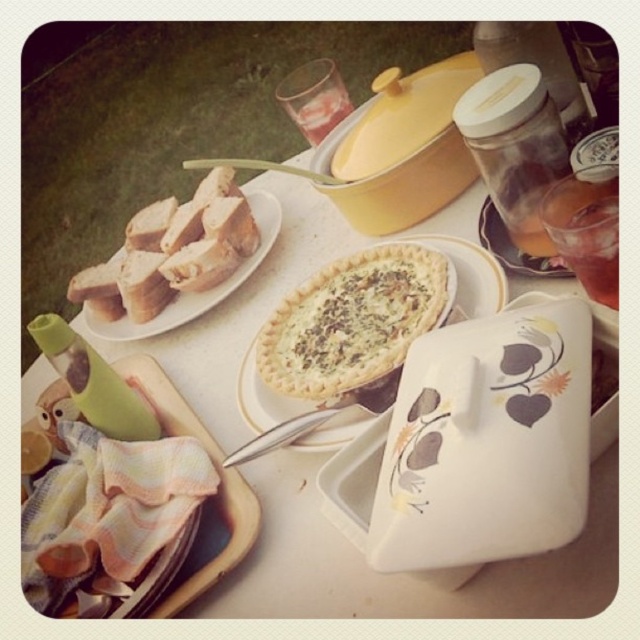
Question: Can you confirm if golden flaky pie at center is wider than white ceramic plate at upper left?

Choices:
 (A) no
 (B) yes

Answer: (A)

Question: Which object appears farthest from the camera in this image?

Choices:
 (A) white ceramic plate at upper left
 (B) golden flaky pie at center
 (C) translucent glass at upper right
 (D) white ceramic tray at lower left

Answer: (A)

Question: Which is farther from the translucent glass at upper right?

Choices:
 (A) golden flaky pie at center
 (B) white ceramic tray at lower left

Answer: (B)

Question: Is white ceramic tray at lower left thinner than white ceramic plate at upper left?

Choices:
 (A) no
 (B) yes

Answer: (B)

Question: Does golden flaky pie at center have a lesser width compared to white ceramic tray at lower left?

Choices:
 (A) no
 (B) yes

Answer: (B)

Question: Which point is closer to the camera?

Choices:
 (A) white ceramic plate at upper left
 (B) golden flaky pie at center
 (C) translucent glass at upper right
 (D) white ceramic tray at lower left

Answer: (D)